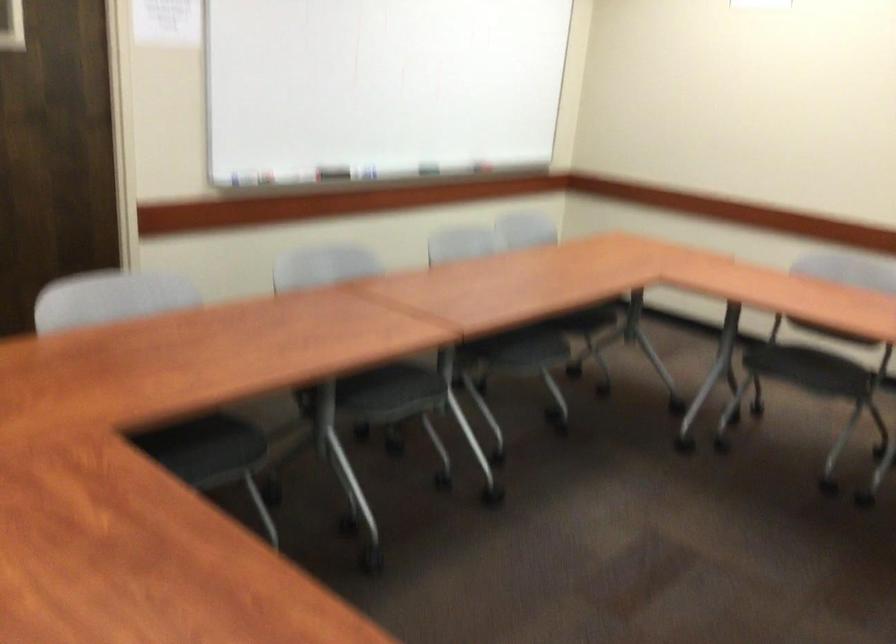
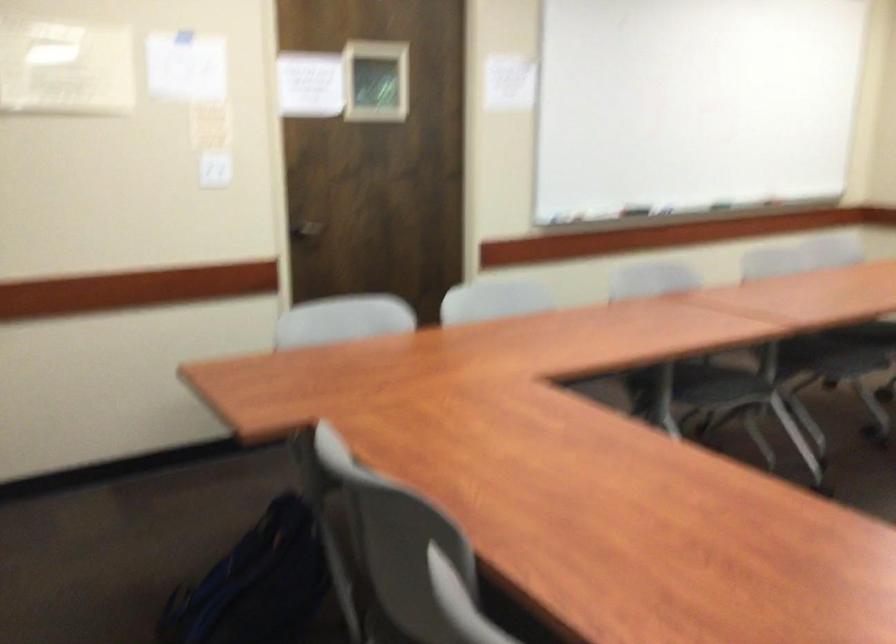
Locate, in the second image, the point that corresponds to [532,335] in the first image.

(860, 341)